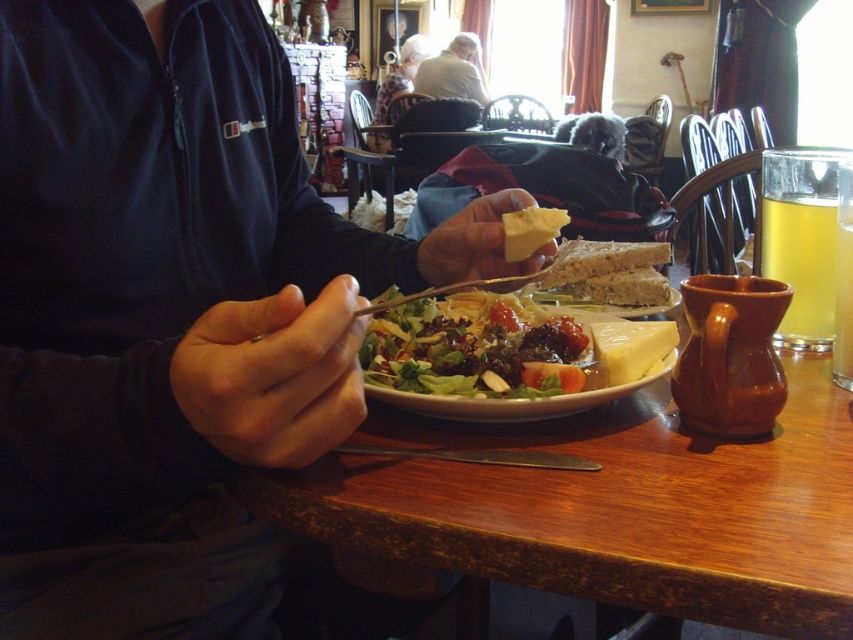
Does translucent glass mug at upper right lie behind yellow creamy cheese at plate center?

That is False.

Looking at this image, who is taller, translucent glass mug at upper right or yellow creamy cheese at plate center?

Standing taller between the two is translucent glass mug at upper right.

Between point (833, 291) and point (621, 369), which one is positioned in front?

Point (621, 369) is in front.

I want to click on translucent glass mug at upper right, so click(802, 266).

Who is taller, wooden table at center or yellow cheese at center?

wooden table at center is taller.

Is wooden table at center thinner than yellow cheese at center?

In fact, wooden table at center might be wider than yellow cheese at center.

The height and width of the screenshot is (640, 853). What do you see at coordinates (608, 506) in the screenshot?
I see `wooden table at center` at bounding box center [608, 506].

Identify the location of wooden table at center. This screenshot has width=853, height=640. (608, 506).

Is wooden table at center to the left of translucent glass mug at upper right from the viewer's perspective?

Correct, you'll find wooden table at center to the left of translucent glass mug at upper right.

Between wooden table at center and translucent glass mug at upper right, which one appears on the left side from the viewer's perspective?

Positioned to the left is wooden table at center.

Measure the distance between wooden table at center and camera.

wooden table at center and camera are 13.97 inches apart from each other.

Where is `wooden table at center`? wooden table at center is located at coordinates (608, 506).